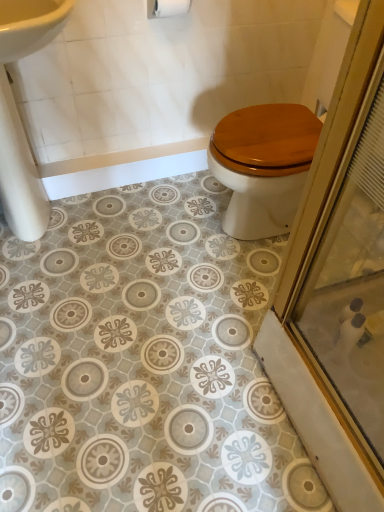
Image resolution: width=384 pixels, height=512 pixels. Describe the element at coordinates (171, 7) in the screenshot. I see `white matte toilet paper at upper center` at that location.

Find the location of a particular element. The height and width of the screenshot is (512, 384). white matte toilet paper at upper center is located at coordinates (171, 7).

The width and height of the screenshot is (384, 512). Describe the element at coordinates (18, 114) in the screenshot. I see `white glossy sink at upper left` at that location.

In order to click on white glossy sink at upper left in this screenshot , I will do `click(18, 114)`.

The width and height of the screenshot is (384, 512). In order to click on white matte toilet paper at upper center in this screenshot , I will do coord(171,7).

Considering the positions of objects white matte toilet paper at upper center and white glossy sink at upper left in the image provided, who is more to the left, white matte toilet paper at upper center or white glossy sink at upper left?

white glossy sink at upper left is more to the left.

Considering the positions of objects white matte toilet paper at upper center and white glossy sink at upper left in the image provided, who is in front, white matte toilet paper at upper center or white glossy sink at upper left?

white glossy sink at upper left is in front.

From the picture: Which is closer, (188, 10) or (2, 188)?

The point (2, 188) is in front.

From the image's perspective, is white matte toilet paper at upper center above or below white glossy sink at upper left?

white matte toilet paper at upper center is situated higher than white glossy sink at upper left in the image.

From a real-world perspective, does white matte toilet paper at upper center sit lower than white glossy sink at upper left?

No, from a real-world perspective, white matte toilet paper at upper center is not under white glossy sink at upper left.

Does white matte toilet paper at upper center have a lesser width compared to white glossy sink at upper left?

Yes.

Between white matte toilet paper at upper center and white glossy sink at upper left, which one has more height?

Standing taller between the two is white glossy sink at upper left.

Looking at the image, does white matte toilet paper at upper center seem bigger or smaller compared to white glossy sink at upper left?

Considering their sizes, white matte toilet paper at upper center takes up less space than white glossy sink at upper left.

From the picture: Do you think white matte toilet paper at upper center is within white glossy sink at upper left, or outside of it?

white matte toilet paper at upper center is outside white glossy sink at upper left.

Is white matte toilet paper at upper center directly adjacent to white glossy sink at upper left?

white matte toilet paper at upper center and white glossy sink at upper left are not in contact.

Is white matte toilet paper at upper center facing towards white glossy sink at upper left?

No, white matte toilet paper at upper center is not facing towards white glossy sink at upper left.

How far apart are white matte toilet paper at upper center and white glossy sink at upper left?

A distance of 29.43 inches exists between white matte toilet paper at upper center and white glossy sink at upper left.

Locate an element on the screen. toilet paper that is above the white glossy sink at upper left (from the image's perspective) is located at coordinates pyautogui.click(x=171, y=7).

Between white glossy sink at upper left and white matte toilet paper at upper center, which one appears on the right side from the viewer's perspective?

white matte toilet paper at upper center is more to the right.

In the image, is white glossy sink at upper left positioned in front of or behind white matte toilet paper at upper center?

Visually, white glossy sink at upper left is located in front of white matte toilet paper at upper center.

Does point (28, 32) lie behind point (170, 8)?

No, it is not.

From the image's perspective, does white glossy sink at upper left appear higher than white matte toilet paper at upper center?

Incorrect, from the image's perspective, white glossy sink at upper left is lower than white matte toilet paper at upper center.

From a real-world perspective, is white glossy sink at upper left located higher than white matte toilet paper at upper center?

Actually, white glossy sink at upper left is physically below white matte toilet paper at upper center in the real world.

Considering the sizes of objects white glossy sink at upper left and white matte toilet paper at upper center in the image provided, who is thinner, white glossy sink at upper left or white matte toilet paper at upper center?

With smaller width is white matte toilet paper at upper center.

Is white glossy sink at upper left taller than white matte toilet paper at upper center?

Yes.

Is white glossy sink at upper left bigger than white matte toilet paper at upper center?

Yes.

Is white glossy sink at upper left inside or outside of white matte toilet paper at upper center?

white glossy sink at upper left is not enclosed by white matte toilet paper at upper center.

Is white glossy sink at upper left far from white matte toilet paper at upper center?

No, white glossy sink at upper left is in close proximity to white matte toilet paper at upper center.

Is white glossy sink at upper left facing towards white matte toilet paper at upper center?

No.

How distant is white glossy sink at upper left from white matte toilet paper at upper center?

The distance of white glossy sink at upper left from white matte toilet paper at upper center is 74.76 centimeters.

Image resolution: width=384 pixels, height=512 pixels. I want to click on toilet paper on the right of white glossy sink at upper left, so click(171, 7).

What are the coordinates of `sink below the white matte toilet paper at upper center (from the image's perspective)` in the screenshot? It's located at (18, 114).

Locate an element on the screen. toilet paper above the white glossy sink at upper left (from a real-world perspective) is located at coordinates (171, 7).